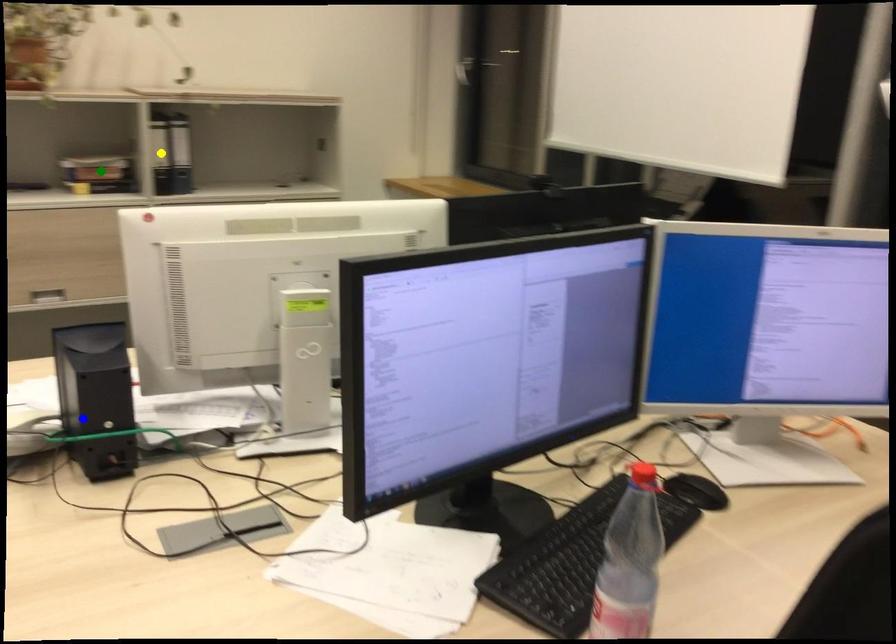
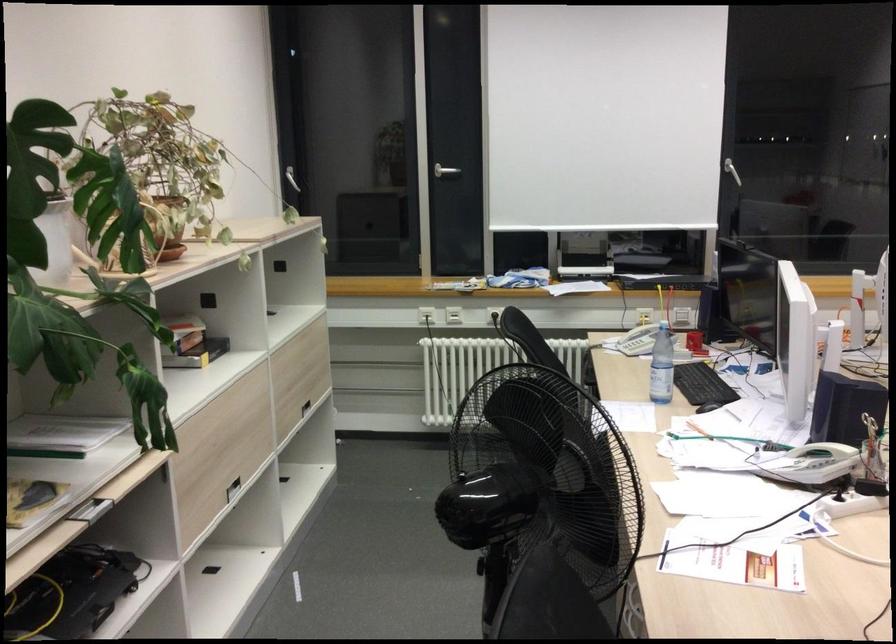
I am providing you with two images of the same scene from different viewpoints. Three points are marked in image1. Which point corresponds to a part or object that is occluded in image2?In image1, three points are marked. Which of them correspond to a part or object that is occluded in image2?Among the three points shown in image1, which one corresponds to a part or object that is no longer visible due to occlusion in image2?

Invisible in image2: yellow point.